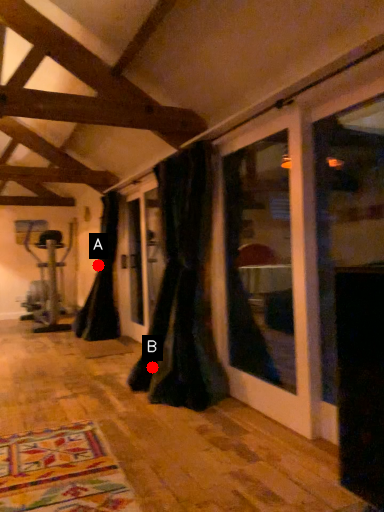
Question: Two points are circled on the image, labeled by A and B beside each circle. Among these points, which one is farthest from the camera?

Choices:
 (A) A is further
 (B) B is further

Answer: (A)